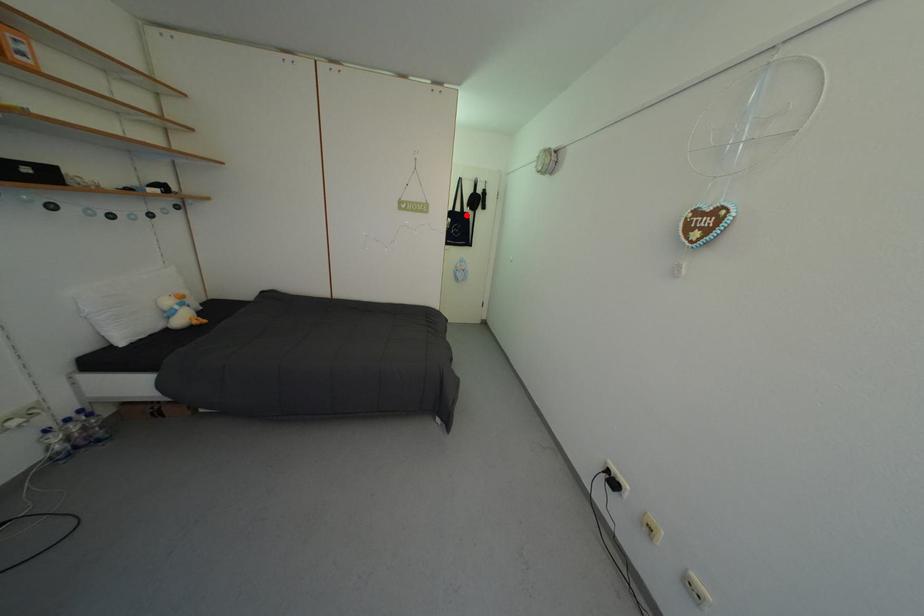
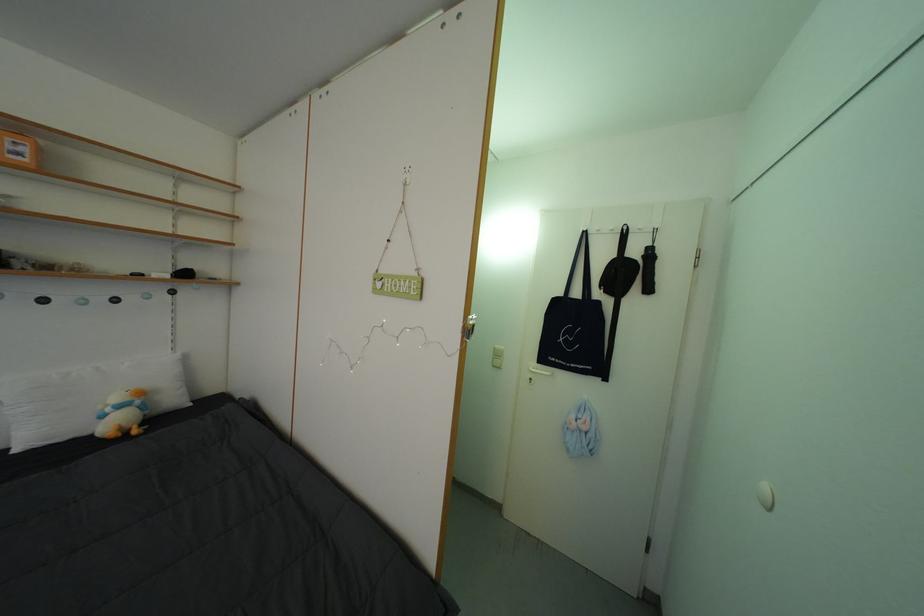
In the second image, find the point that corresponds to the highlighted location in the first image.

(586, 300)